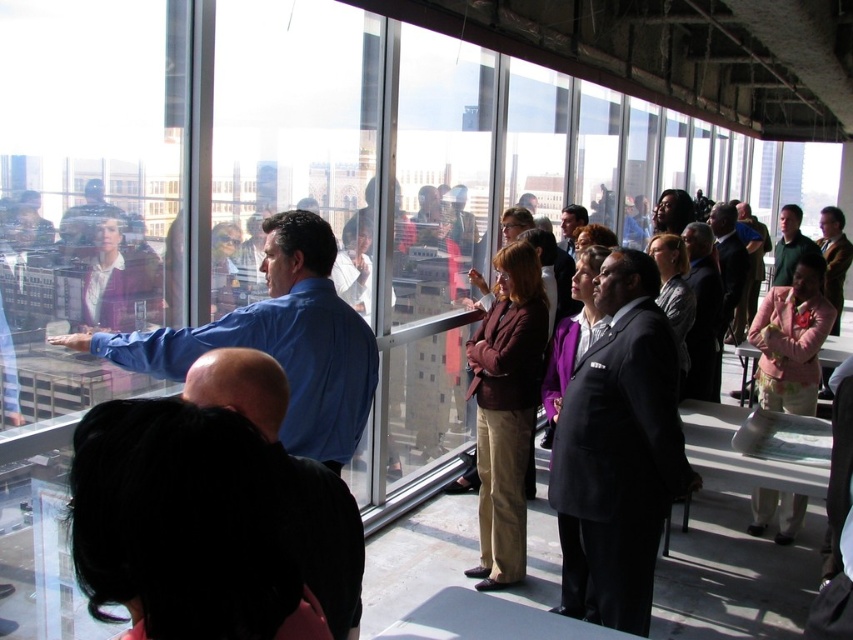
Question: Which of the following is the closest to the observer?

Choices:
 (A) blue shirt at center
 (B) matte blue shirt at upper center
 (C) black matte shirt at lower left
 (D) dark gray suit at center

Answer: (C)

Question: Does blue shirt at center have a lesser width compared to matte black suit at center?

Choices:
 (A) yes
 (B) no

Answer: (B)

Question: Does matte blue shirt at upper center have a smaller size compared to matte black suit at center?

Choices:
 (A) no
 (B) yes

Answer: (B)

Question: Does blue shirt at center appear over dark green shirt at right?

Choices:
 (A) no
 (B) yes

Answer: (A)

Question: Which object appears closest to the camera in this image?

Choices:
 (A) dark suit at center
 (B) black matte shirt at lower left
 (C) matte black suit at center

Answer: (B)

Question: Which of the following is the closest to the observer?

Choices:
 (A) dark green shirt at right
 (B) matte blue shirt at upper center

Answer: (B)